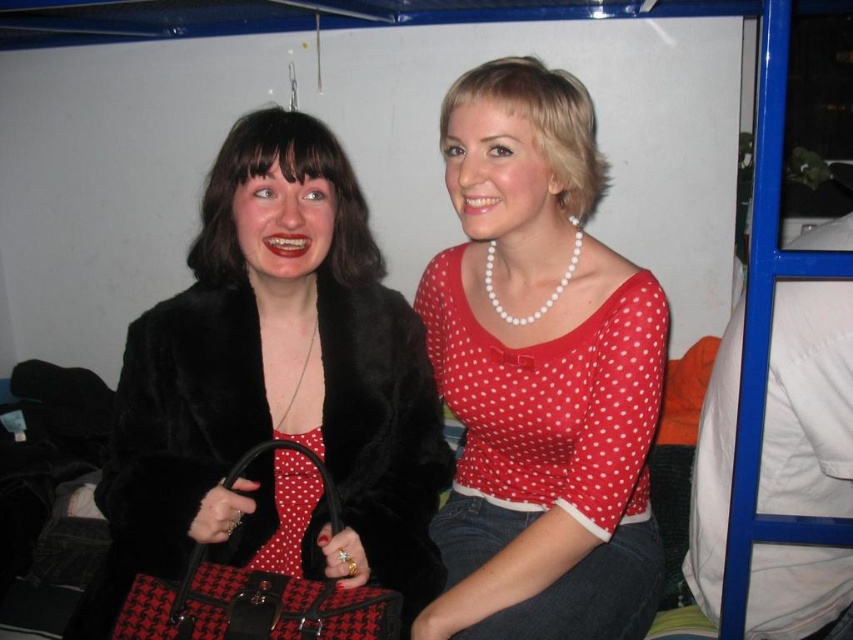
Between point (553, 77) and point (312, 465), which one is positioned behind?

The point (312, 465) is behind.

Is the position of pearl necklace at upper center more distant than that of houndstooth fabric handbag at center?

Yes.

Describe the element at coordinates (538, 374) in the screenshot. Image resolution: width=853 pixels, height=640 pixels. I see `pearl necklace at upper center` at that location.

This screenshot has width=853, height=640. I want to click on pearl necklace at upper center, so click(538, 374).

Does matte black fur coat at left have a greater width compared to houndstooth fabric handbag at center?

Correct, the width of matte black fur coat at left exceeds that of houndstooth fabric handbag at center.

From the picture: Between matte black fur coat at left and houndstooth fabric handbag at center, which one appears on the left side from the viewer's perspective?

Positioned to the left is houndstooth fabric handbag at center.

Which is in front, point (291, 488) or point (207, 576)?

Point (207, 576)

Locate an element on the screen. The image size is (853, 640). matte black fur coat at left is located at coordinates pos(276,390).

Does point (366, 288) come closer to viewer compared to point (560, 545)?

No, it is behind (560, 545).

Between matte black fur coat at left and pearl necklace at upper center, which one appears on the left side from the viewer's perspective?

From the viewer's perspective, matte black fur coat at left appears more on the left side.

Find the location of `matte black fur coat at left`. matte black fur coat at left is located at coordinates (276, 390).